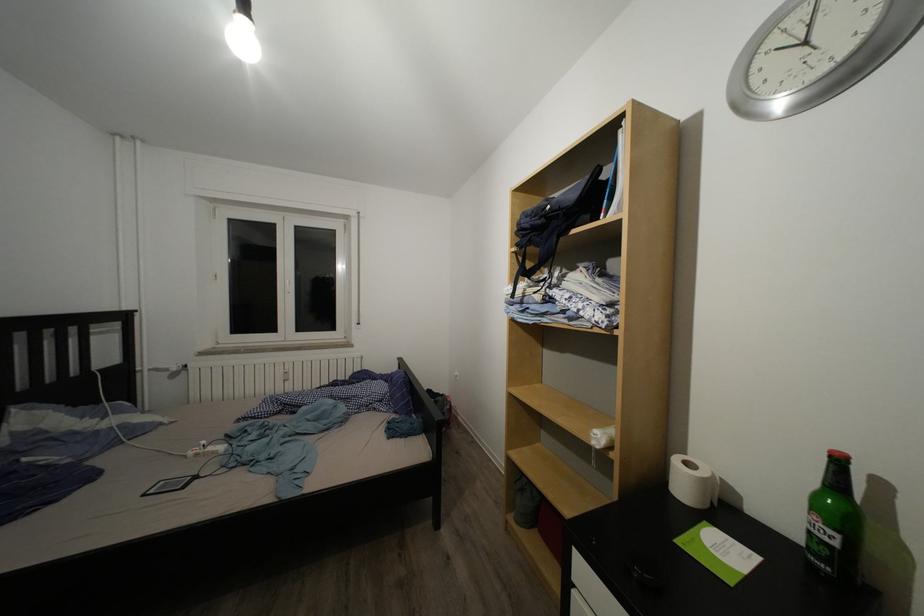
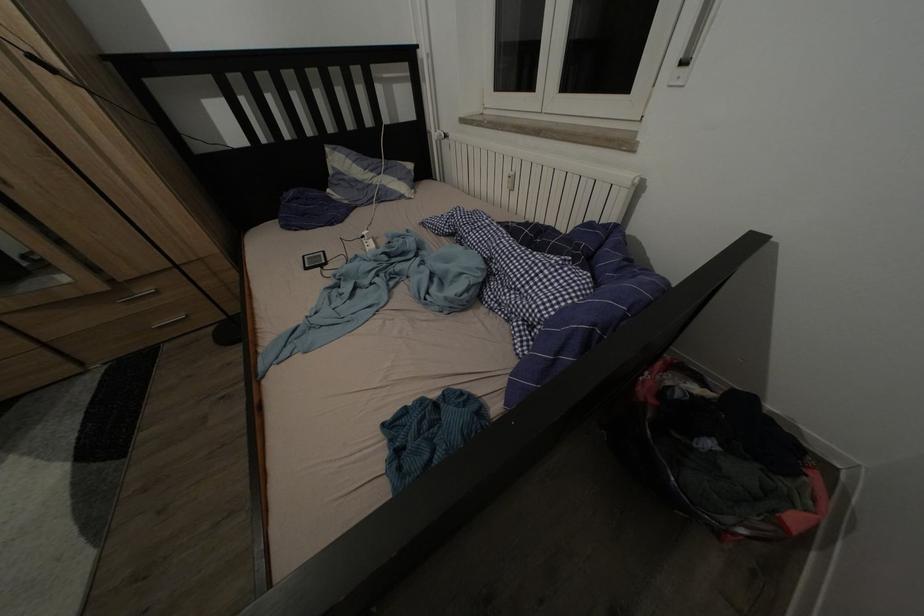
In the second image, find the point that corresponds to the point at 211,448 in the first image.

(372, 238)